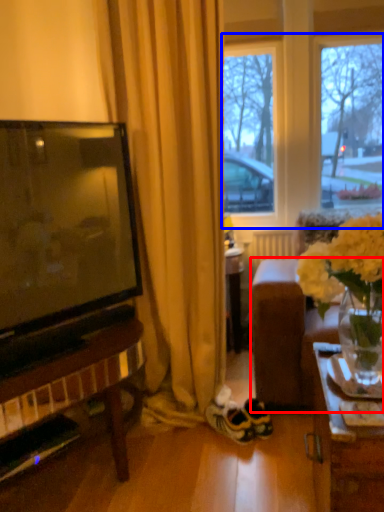
Question: Which object is further to the camera taking this photo, studio couch (highlighted by a red box) or window frame (highlighted by a blue box)?

Choices:
 (A) studio couch
 (B) window frame

Answer: (B)